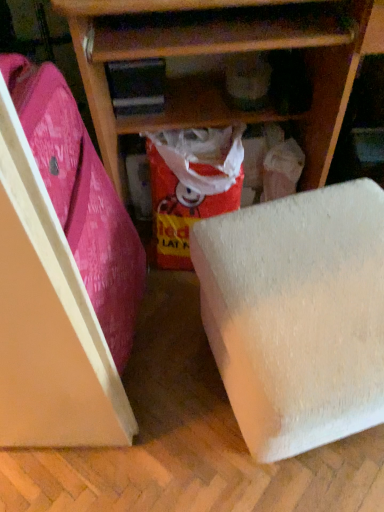
Question: Visually, is wooden shelf at center positioned to the left or to the right of red glossy paper at center?

Choices:
 (A) right
 (B) left

Answer: (A)

Question: Is wooden shelf at center inside the boundaries of red glossy paper at center, or outside?

Choices:
 (A) outside
 (B) inside

Answer: (A)

Question: Based on their relative distances, which object is nearer to the pink fabric suitcase at left?

Choices:
 (A) white foam block at lower right
 (B) wooden shelf at center
 (C) red glossy paper at center

Answer: (C)

Question: Considering the real-world distances, which object is farthest from the white foam block at lower right?

Choices:
 (A) wooden shelf at center
 (B) red glossy paper at center
 (C) pink fabric suitcase at left

Answer: (A)